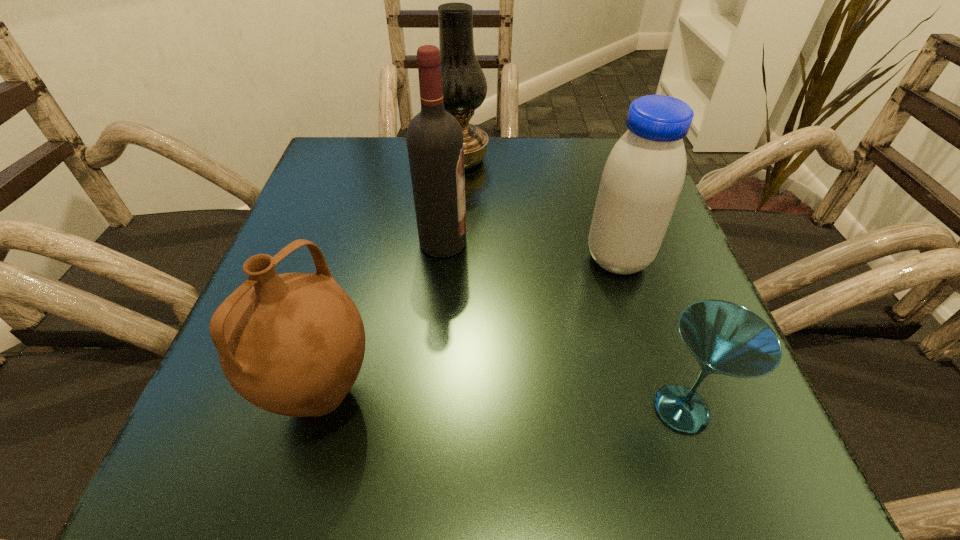
Locate an element on the screen. The width and height of the screenshot is (960, 540). object that is at the far edge is located at coordinates (464, 84).

At what (x,y) coordinates should I click in order to perform the action: click on pitcher at the near edge. Please return your answer as a coordinate pair (x, y). The height and width of the screenshot is (540, 960). Looking at the image, I should click on (293, 344).

At what (x,y) coordinates should I click in order to perform the action: click on martini that is at the near edge. Please return your answer as a coordinate pair (x, y). Looking at the image, I should click on (725, 338).

What are the coordinates of `object that is at the left edge` in the screenshot? It's located at (293, 344).

Find the location of `soya milk that is at the right edge`. soya milk that is at the right edge is located at coordinates (643, 177).

I want to click on martini present at the right edge, so click(725, 338).

At what (x,y) coordinates should I click in order to perform the action: click on object located at the near left corner. Please return your answer as a coordinate pair (x, y). This screenshot has height=540, width=960. Looking at the image, I should click on (293, 344).

Where is `object that is at the near right corner`? The width and height of the screenshot is (960, 540). object that is at the near right corner is located at coordinates (725, 338).

Locate an element on the screen. The width and height of the screenshot is (960, 540). free region at the far edge of the desktop is located at coordinates (544, 180).

Locate an element on the screen. This screenshot has height=540, width=960. vacant space at the near edge of the desktop is located at coordinates (628, 467).